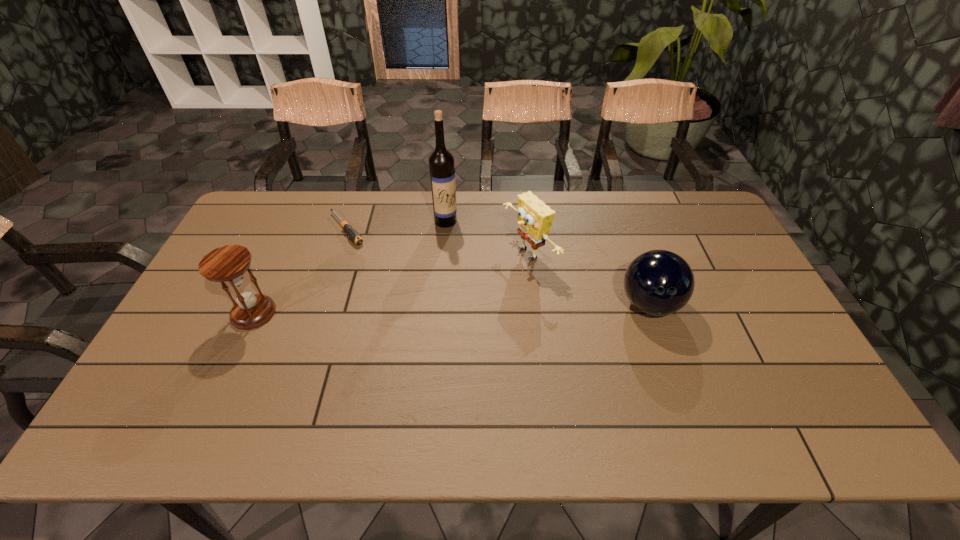
Locate an element on the screen. This screenshot has height=540, width=960. sponge at the far edge is located at coordinates (535, 218).

You are a GUI agent. You are given a task and a screenshot of the screen. Output one action in this format:
    pyautogui.click(x=<x>, y=<y>)
    Task: Click on the object that is at the left edge
    This screenshot has height=540, width=960.
    Given the screenshot: What is the action you would take?
    pyautogui.click(x=227, y=264)

The width and height of the screenshot is (960, 540). In order to click on vacant space at the far edge of the desktop in this screenshot , I will do `click(335, 204)`.

What are the coordinates of `vacant space at the near edge of the desktop` in the screenshot? It's located at (645, 384).

Identify the location of blank space at the left edge of the desktop. (228, 242).

Identify the location of vacant space at the right edge of the desktop. The height and width of the screenshot is (540, 960). (707, 283).

Identify the location of free space at the far left corner of the desktop. (248, 231).

In the image, there is a desktop. Where is `vacant space at the near left corner`? The image size is (960, 540). vacant space at the near left corner is located at coordinates (163, 372).

The width and height of the screenshot is (960, 540). In order to click on vacant region at the far right corner of the desktop in this screenshot , I will do `click(698, 198)`.

Identify the location of vacant area that lies between the sponge and the tallest object. Image resolution: width=960 pixels, height=540 pixels. (488, 238).